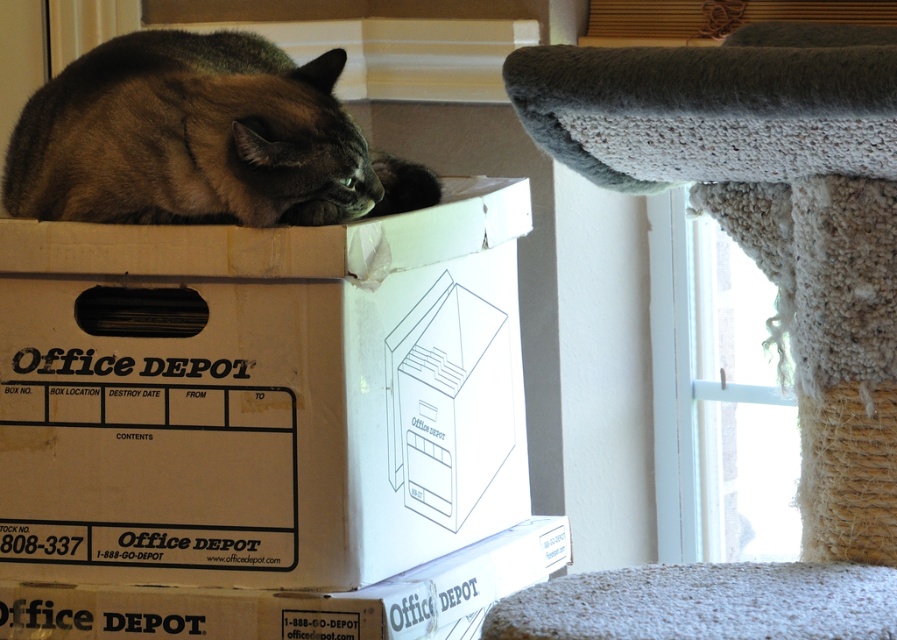
Is dark brown fur cat at upper left wider than matte brown cardboard box at center?

No, dark brown fur cat at upper left is not wider than matte brown cardboard box at center.

Does dark brown fur cat at upper left have a greater height compared to matte brown cardboard box at center?

Correct, dark brown fur cat at upper left is much taller as matte brown cardboard box at center.

Between point (172, 116) and point (94, 625), which one is positioned behind?

Positioned behind is point (94, 625).

Identify the location of dark brown fur cat at upper left. (199, 140).

Is point (55, 627) farther from viewer compared to point (730, 632)?

Yes, it is.

Does matte brown cardboard box at center have a greater height compared to textured gray carpet at lower right?

Correct, matte brown cardboard box at center is much taller as textured gray carpet at lower right.

Describe the element at coordinates (303, 600) in the screenshot. This screenshot has height=640, width=897. I see `matte brown cardboard box at center` at that location.

This screenshot has height=640, width=897. I want to click on matte brown cardboard box at center, so click(303, 600).

Between white cardboard box at center and matte brown cardboard box at center, which one is positioned higher?

white cardboard box at center is higher up.

Between white cardboard box at center and matte brown cardboard box at center, which one appears on the right side from the viewer's perspective?

matte brown cardboard box at center

You are a GUI agent. You are given a task and a screenshot of the screen. Output one action in this format:
    pyautogui.click(x=<x>, y=<y>)
    Task: Click on the white cardboard box at center
    
    Given the screenshot: What is the action you would take?
    pyautogui.click(x=260, y=396)